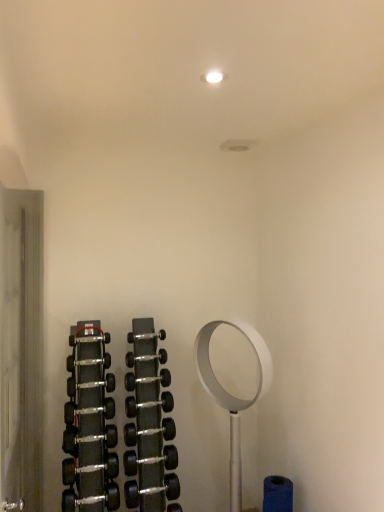
Question: Should I look upward or downward to see black metallic dumbbell at center, marked as the first dumbbell in a top-to-bottom arrangement?

Choices:
 (A) up
 (B) down

Answer: (B)

Question: Could you tell me if black metallic dumbbell at center, which is the eighth dumbbell in top-to-bottom order, is facing black rubber dumbbell at center, marked as the second dumbbell in a top-to-bottom arrangement?

Choices:
 (A) yes
 (B) no

Answer: (B)

Question: Is black metallic dumbbell at center, the first dumbbell positioned from the bottom, bigger than black rubber dumbbell at center, acting as the seventh dumbbell starting from the bottom?

Choices:
 (A) no
 (B) yes

Answer: (B)

Question: Is black metallic dumbbell at center, the first dumbbell positioned from the bottom, positioned with its back to black rubber dumbbell at center, acting as the seventh dumbbell starting from the bottom?

Choices:
 (A) no
 (B) yes

Answer: (A)

Question: Considering the relative sizes of black metallic dumbbell at center, which is the eighth dumbbell in top-to-bottom order, and black rubber dumbbell at center, marked as the second dumbbell in a top-to-bottom arrangement, in the image provided, is black metallic dumbbell at center, which is the eighth dumbbell in top-to-bottom order, smaller than black rubber dumbbell at center, marked as the second dumbbell in a top-to-bottom arrangement,?

Choices:
 (A) yes
 (B) no

Answer: (B)

Question: Can you confirm if black metallic dumbbell at center, the first dumbbell positioned from the bottom, is wider than black rubber dumbbell at center, acting as the seventh dumbbell starting from the bottom?

Choices:
 (A) no
 (B) yes

Answer: (B)

Question: Is black metallic dumbbell at center, which is the eighth dumbbell in top-to-bottom order, outside of black rubber dumbbell at center, acting as the seventh dumbbell starting from the bottom?

Choices:
 (A) yes
 (B) no

Answer: (A)

Question: From a real-world perspective, is black rubber dumbbell at center, which is the fifth dumbbell in bottom-to-top order, physically above black rubber dumbbell at center, acting as the seventh dumbbell starting from the bottom?

Choices:
 (A) yes
 (B) no

Answer: (B)

Question: Does black rubber dumbbell at center, which ranks as the 4th dumbbell in top-to-bottom order, have a greater height compared to black rubber dumbbell at center, acting as the seventh dumbbell starting from the bottom?

Choices:
 (A) yes
 (B) no

Answer: (A)

Question: Can you confirm if black rubber dumbbell at center, which is the fifth dumbbell in bottom-to-top order, is wider than black rubber dumbbell at center, acting as the seventh dumbbell starting from the bottom?

Choices:
 (A) yes
 (B) no

Answer: (A)

Question: Is black rubber dumbbell at center, which is the fifth dumbbell in bottom-to-top order, smaller than black rubber dumbbell at center, acting as the seventh dumbbell starting from the bottom?

Choices:
 (A) no
 (B) yes

Answer: (A)

Question: Considering the relative positions of black rubber dumbbell at center, which is the fifth dumbbell in bottom-to-top order, and black rubber dumbbell at center, marked as the second dumbbell in a top-to-bottom arrangement, in the image provided, is black rubber dumbbell at center, which is the fifth dumbbell in bottom-to-top order, to the left of black rubber dumbbell at center, marked as the second dumbbell in a top-to-bottom arrangement, from the viewer's perspective?

Choices:
 (A) yes
 (B) no

Answer: (B)

Question: Is the depth of black rubber dumbbell at center, which ranks as the 4th dumbbell in top-to-bottom order, greater than that of black rubber dumbbell at center, acting as the seventh dumbbell starting from the bottom?

Choices:
 (A) no
 (B) yes

Answer: (A)

Question: Is black rubber dumbbell at center, which ranks as the 4th dumbbell in top-to-bottom order, smaller than black rubber dumbbell at center, which is the 6th dumbbell from top to bottom?

Choices:
 (A) no
 (B) yes

Answer: (B)